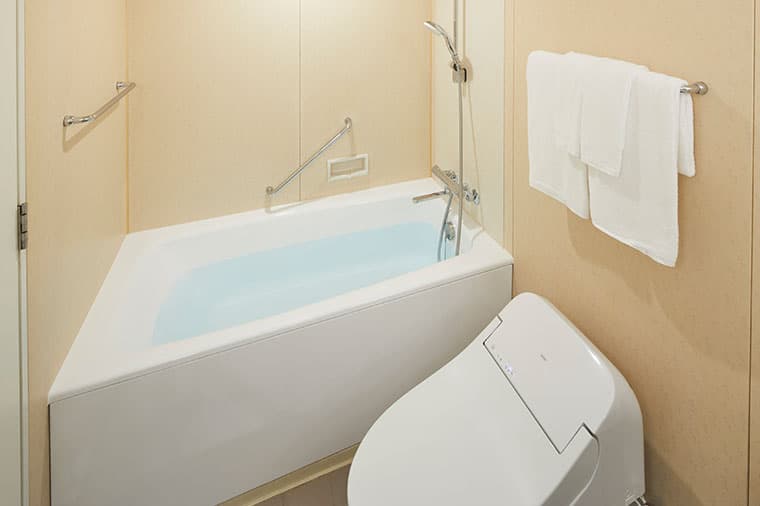
This screenshot has height=506, width=760. I want to click on shower head, so click(x=428, y=26).